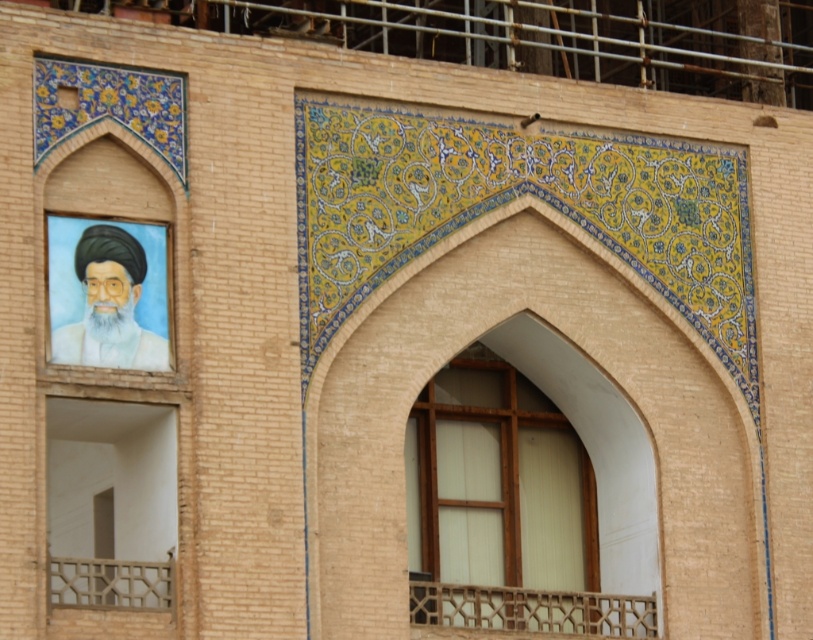
You are standing in front of a building with intricate brickwork and two decorative panels. You notice a specific point marked at coordinates point (554,596). Given that you are 55.72 meters away from this point, can you estimate how far you are from the building itself?

The distance between you and the point (554,596) is 55.72 meters. Since the point is on the building, your distance from the building is also 55.72 meters.

You are an architect examining a building facade. You notice two points marked on the wall at coordinates point (590,609) and point (585,608). Which point is closer to you?

→ Point (590,609) is closer to you because it is further to the viewer than point (585,608).

You are an architect examining the building facade. You notice the wooden lattice at lower center and the white matte robe at left. Which object is located below the other?

The wooden lattice at lower center is positioned under the white matte robe at left.